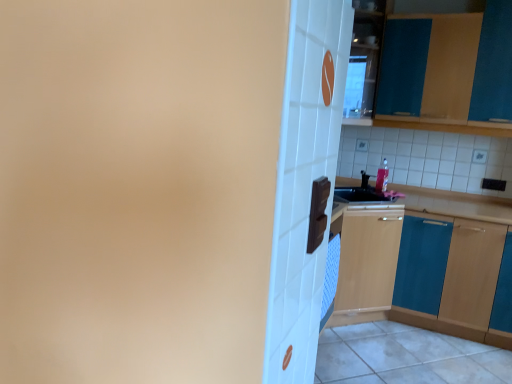
Question: In terms of width, does teal wood cabinet at right, marked as the 2th cabinetry in a top-to-bottom arrangement, look wider or thinner when compared to teal wood cabinet at upper right, the 2th cabinetry ordered from the bottom?

Choices:
 (A) wide
 (B) thin

Answer: (A)

Question: From the image's perspective, is teal wood cabinet at right, placed as the first cabinetry when sorted from bottom to top, positioned above or below teal wood cabinet at upper right, the 2th cabinetry ordered from the bottom?

Choices:
 (A) below
 (B) above

Answer: (A)

Question: Which object is the farthest from the white glossy tile at lower right?

Choices:
 (A) teal wood cabinet at upper right, the 2th cabinetry ordered from the bottom
 (B) teal wood cabinet at right, placed as the first cabinetry when sorted from bottom to top

Answer: (A)

Question: Estimate the real-world distances between objects in this image. Which object is closer to the white glossy tile at lower right?

Choices:
 (A) teal wood cabinet at right, placed as the first cabinetry when sorted from bottom to top
 (B) teal wood cabinet at upper right, positioned as the first cabinetry in top-to-bottom order

Answer: (A)